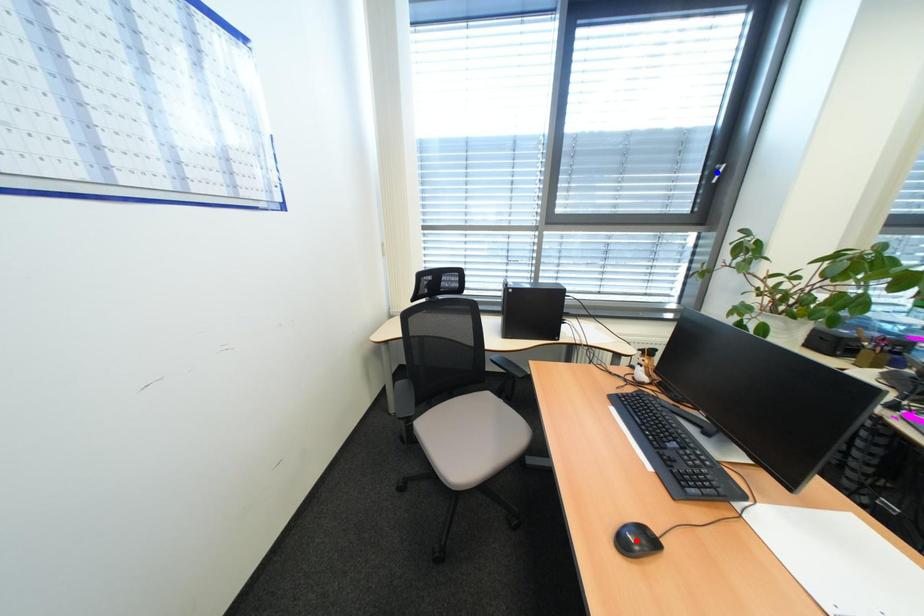
Question: Two points are marked on the image. Which point is closer to the camera?

Choices:
 (A) Blue point is closer.
 (B) Red point is closer.

Answer: (B)